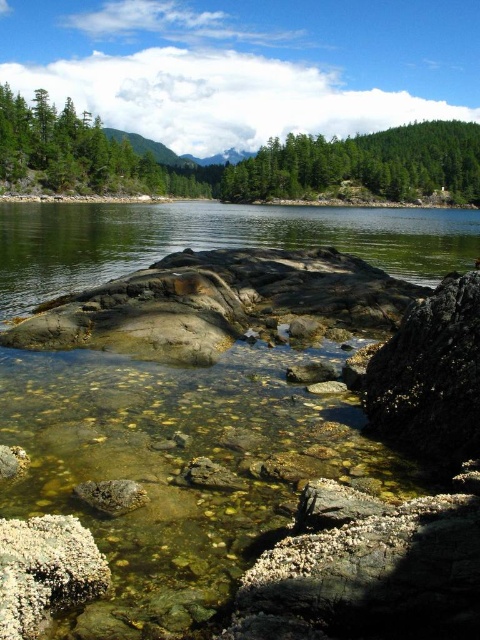
Question: In this image, where is green matte tree at upper center located relative to green matte tree at upper right?

Choices:
 (A) above
 (B) below

Answer: (A)

Question: Which is farther from the green matte tree at upper right?

Choices:
 (A) clear water at center
 (B) white coral-like rock at lower left
 (C) green matte tree at upper center
 (D) smooth gray rock at center-right

Answer: (D)

Question: Does smooth gray rock at center-right appear on the right side of white coral-like rock at lower left?

Choices:
 (A) no
 (B) yes

Answer: (B)

Question: Is smooth gray rock at center-right positioned behind green matte tree at upper left?

Choices:
 (A) yes
 (B) no

Answer: (B)

Question: Which object appears closest to the camera in this image?

Choices:
 (A) green matte tree at upper right
 (B) clear water at center
 (C) green matte tree at upper center
 (D) smooth gray rock at center-right

Answer: (D)

Question: Which object is farther from the camera taking this photo?

Choices:
 (A) green matte tree at upper center
 (B) smooth gray rock at center-right
 (C) clear water at center
 (D) green matte tree at upper right

Answer: (D)